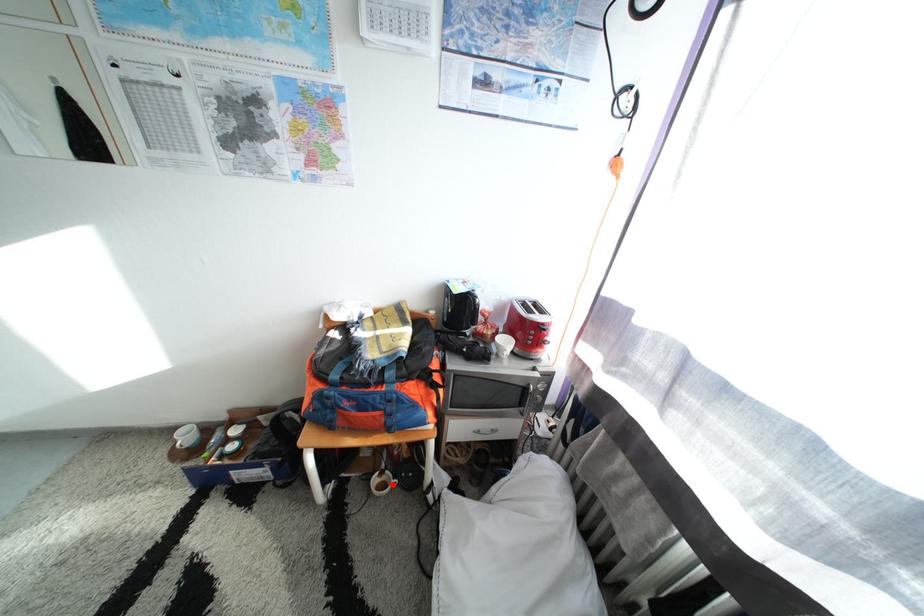
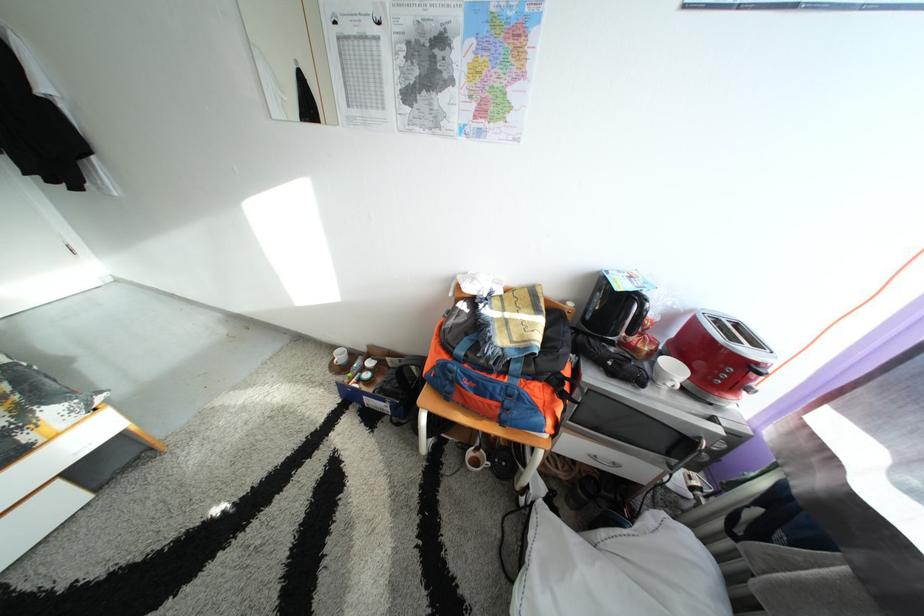
Question: I am providing you with two images of the same scene from different viewpoints. Given a red point in image1, look at the same physical point in image2. Is it:

Choices:
 (A) Closer to the viewpoint
 (B) Farther from the viewpoint

Answer: (B)